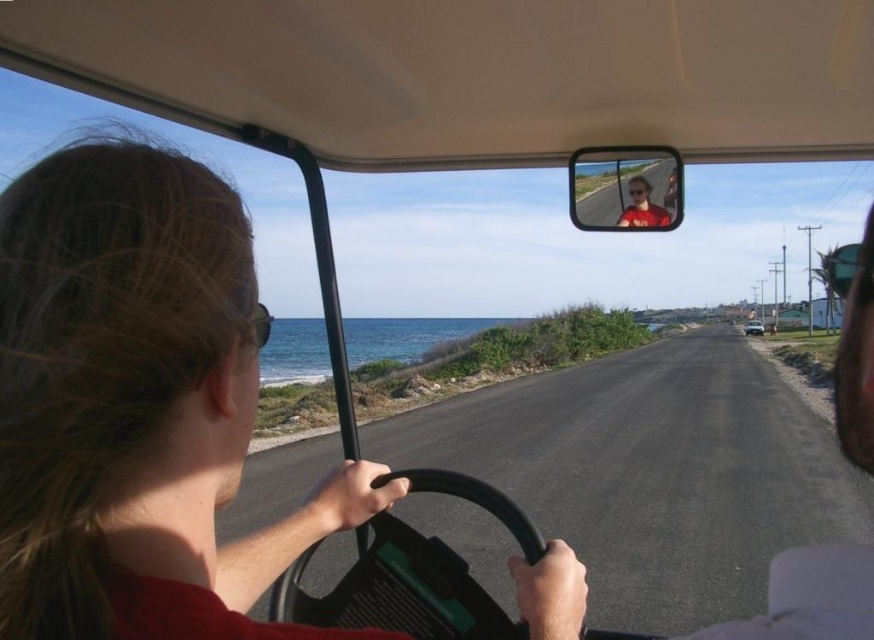
Question: Can you confirm if matte black rearview mirror at upper center is thinner than metallic silver sedan at center?

Choices:
 (A) yes
 (B) no

Answer: (A)

Question: Which of the following is the farthest from the observer?

Choices:
 (A) matte black rearview mirror at upper center
 (B) matte red shirt at center

Answer: (A)

Question: Estimate the real-world distances between objects in this image. Which object is farther from the matte red shirt at center?

Choices:
 (A) matte black rearview mirror at upper center
 (B) metallic silver sedan at center

Answer: (B)

Question: Does matte red shirt at center appear on the right side of metallic silver sedan at center?

Choices:
 (A) yes
 (B) no

Answer: (B)

Question: Is matte red shirt at center bigger than metallic silver sedan at center?

Choices:
 (A) yes
 (B) no

Answer: (A)

Question: Among these objects, which one is farthest from the camera?

Choices:
 (A) matte black rearview mirror at upper center
 (B) matte red shirt at center

Answer: (A)